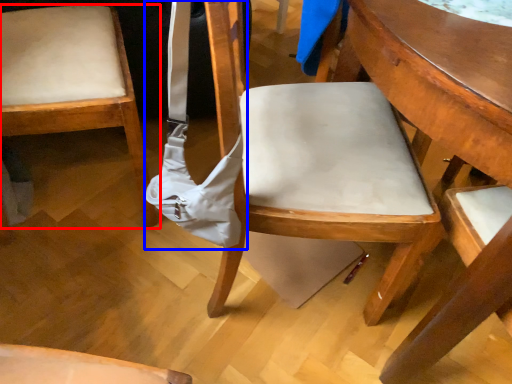
Question: Which object is further to the camera taking this photo, chair (highlighted by a red box) or shoulder bag (highlighted by a blue box)?

Choices:
 (A) chair
 (B) shoulder bag

Answer: (A)